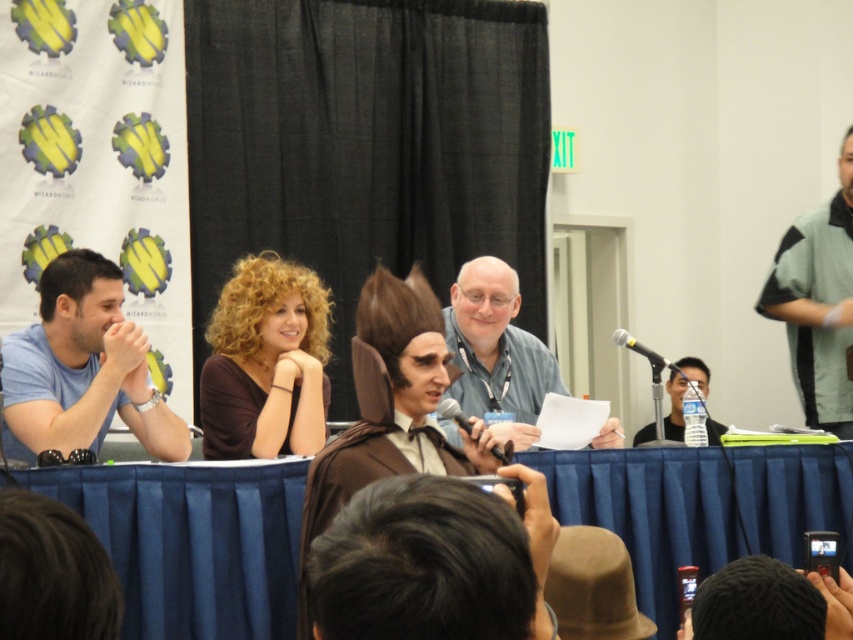
Question: Where is gray fabric shirt at center located in relation to clear plastic water bottle at center in the image?

Choices:
 (A) below
 (B) above

Answer: (B)

Question: Among these objects, which one is nearest to the camera?

Choices:
 (A) clear plastic water bottle at center
 (B) gray fabric shirt at center

Answer: (B)

Question: Does brown matte shirt at center appear over clear plastic water bottle at center?

Choices:
 (A) no
 (B) yes

Answer: (B)

Question: Which object is positioned farthest from the gray fabric shirt at center?

Choices:
 (A) black matte microphone at center
 (B) black metallic microphone at right
 (C) brown matte shirt at center

Answer: (A)

Question: Is gray fabric shirt at center above black metallic microphone at right?

Choices:
 (A) no
 (B) yes

Answer: (B)

Question: Which of these objects is positioned closest to the gray fabric shirt at center?

Choices:
 (A) blue cotton shirt at left
 (B) black matte microphone at center
 (C) brown matte shirt at center

Answer: (C)